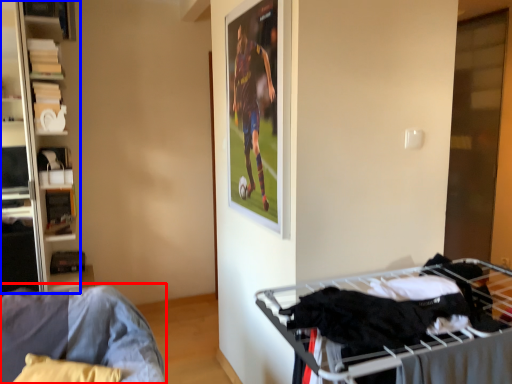
Question: Among these objects, which one is farthest to the camera, furniture (highlighted by a red box) or shelf (highlighted by a blue box)?

Choices:
 (A) furniture
 (B) shelf

Answer: (B)